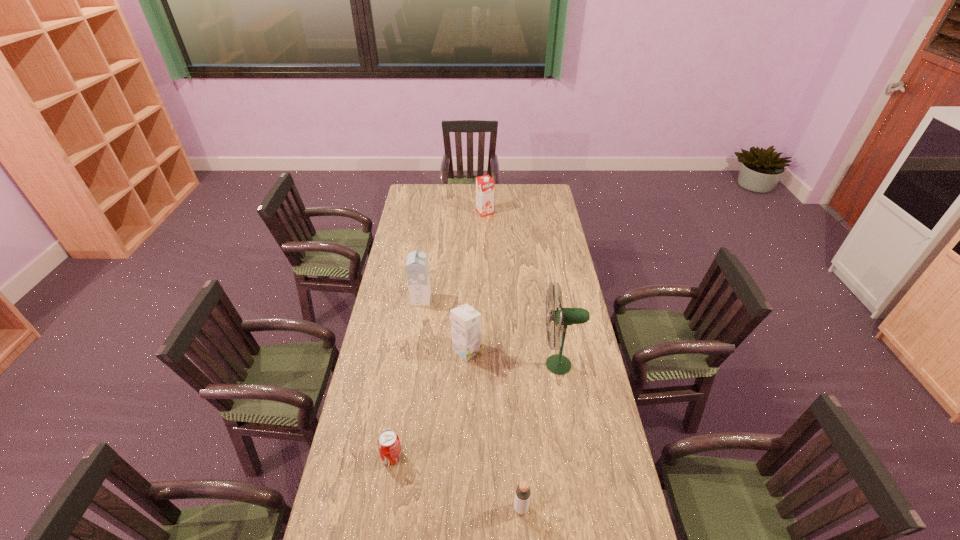
Where is `fan`? fan is located at coordinates (558, 364).

Locate an element on the screen. This screenshot has width=960, height=540. the tallest object is located at coordinates (558, 364).

You are a GUI agent. You are given a task and a screenshot of the screen. Output one action in this format:
    pyautogui.click(x=<x>, y=<y>)
    Task: Click on the second farthest object
    
    Given the screenshot: What is the action you would take?
    pyautogui.click(x=417, y=269)

Where is `the second nearest carton`? Image resolution: width=960 pixels, height=540 pixels. the second nearest carton is located at coordinates (417, 269).

In order to click on the farthest object in this screenshot , I will do `click(484, 184)`.

The width and height of the screenshot is (960, 540). In order to click on the nearest carton in this screenshot , I will do click(x=465, y=321).

Where is `the fifth tallest object`? The height and width of the screenshot is (540, 960). the fifth tallest object is located at coordinates (523, 491).

This screenshot has height=540, width=960. Identify the location of bottle. (523, 491).

I want to click on the second nearest object, so click(388, 442).

At what (x,y) coordinates should I click in order to perform the action: click on soda. Please return your answer as a coordinate pair (x, y). This screenshot has height=540, width=960. Looking at the image, I should click on (388, 442).